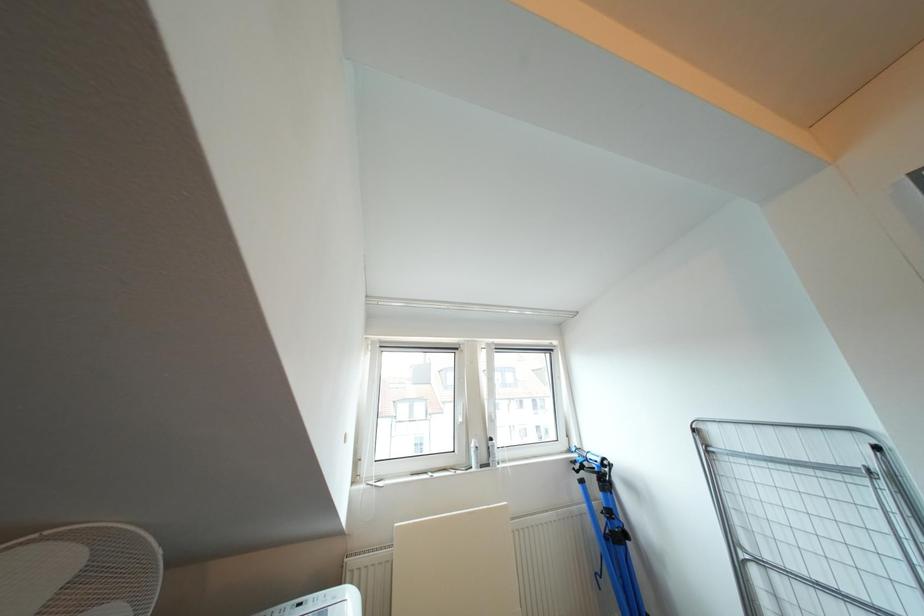
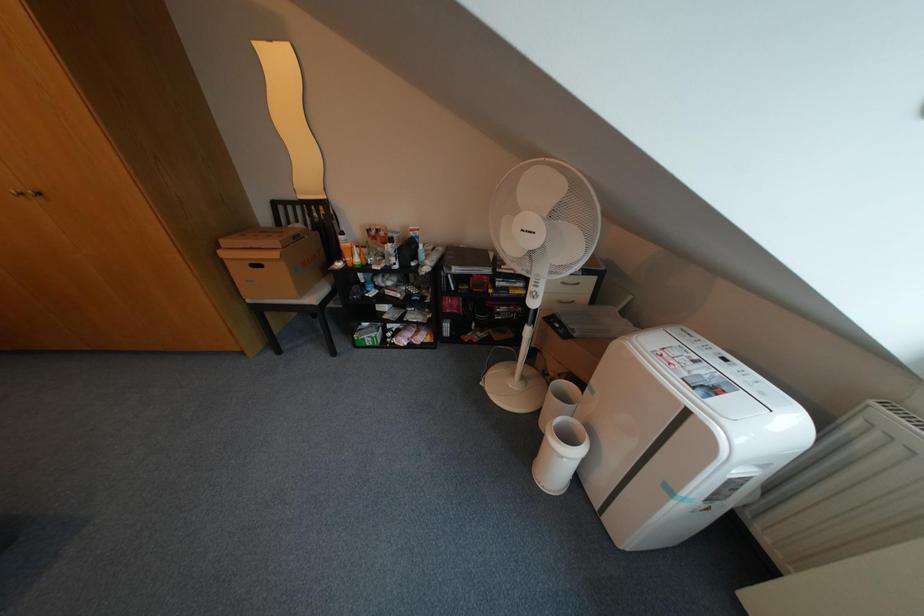
The images are taken continuously from a first-person perspective. In which direction is your viewpoint rotating?

The camera rotated toward left-down.